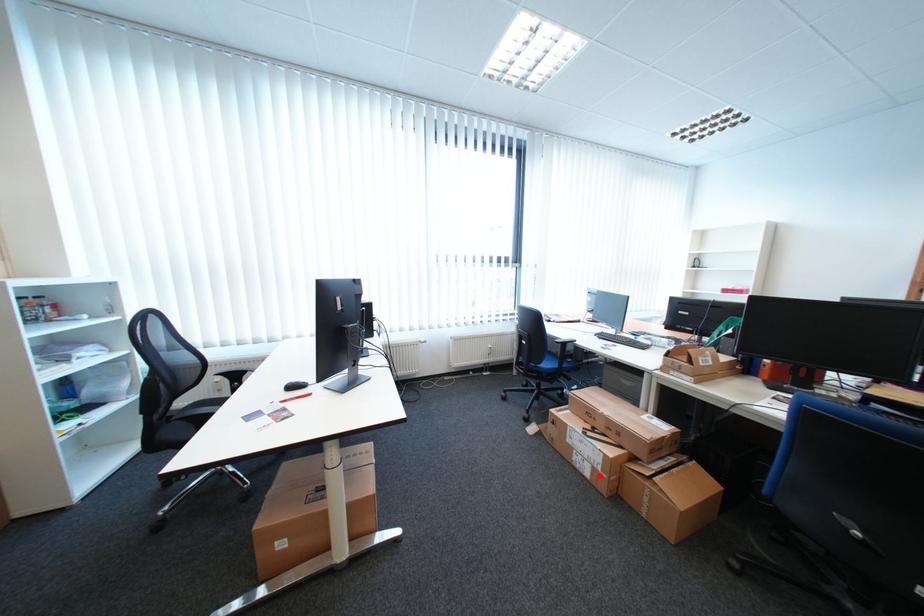
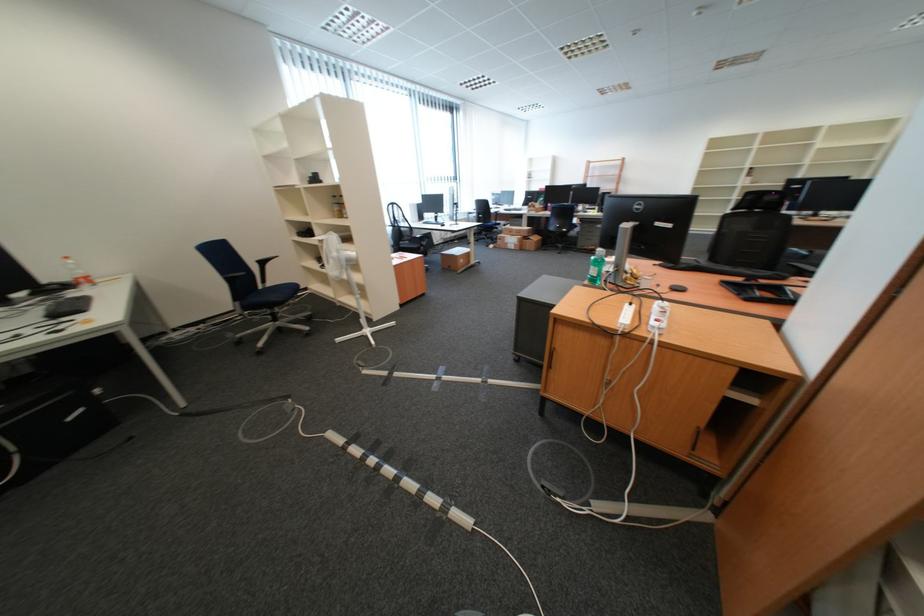
In the second image, find the point that corresponds to the highlighted location in the first image.

(525, 249)